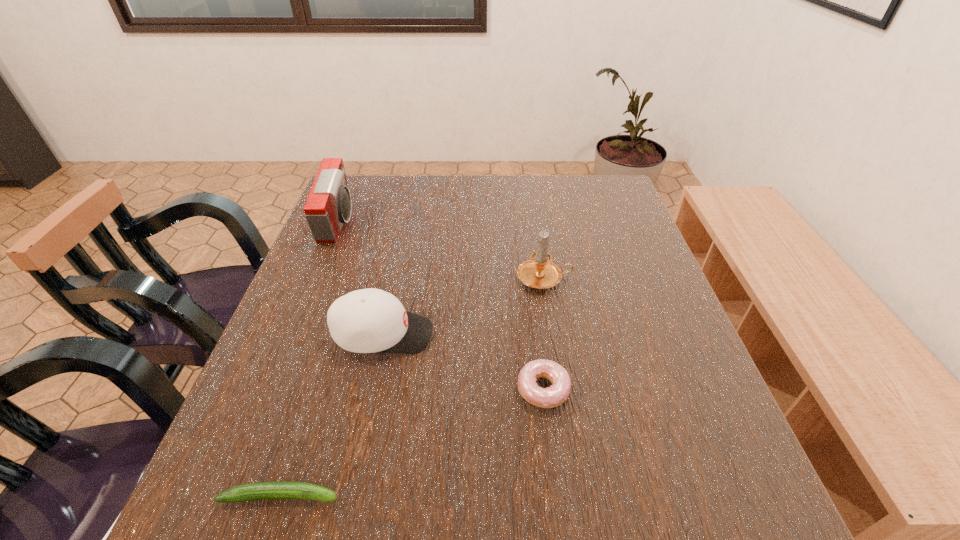
Identify the location of free space between the zucchini and the fourth nearest object. The image size is (960, 540). (413, 387).

Where is `free spot between the candle and the farthest object`? The image size is (960, 540). free spot between the candle and the farthest object is located at coordinates (442, 251).

Where is `unoccupied position between the camera and the fourth tallest object`? Image resolution: width=960 pixels, height=540 pixels. unoccupied position between the camera and the fourth tallest object is located at coordinates (441, 306).

You are a GUI agent. You are given a task and a screenshot of the screen. Output one action in this format:
    pyautogui.click(x=<x>, y=<y>)
    Task: Click on the free spot between the zucchini and the second shortest object
    
    Given the screenshot: What is the action you would take?
    pyautogui.click(x=412, y=443)

At what (x,y) coordinates should I click in order to perform the action: click on empty space between the second farthest object and the camera. Please return your answer as a coordinate pair (x, y). Image resolution: width=960 pixels, height=540 pixels. Looking at the image, I should click on (442, 251).

Find the location of `the second closest object relative to the zucchini`. the second closest object relative to the zucchini is located at coordinates (553, 396).

Select which object is the fourth closest to the third nearest object. Please provide its 2D coordinates. Your answer should be formatted as a tuple, i.e. [(x, y)], where the tuple contains the x and y coordinates of a point satisfying the conditions above.

[(262, 490)]

Locate an element on the screen. free location that satisfies the following two spatial constraints: 1. on the front-facing side of the third shortest object; 2. on the back side of the doughnut is located at coordinates (372, 389).

Find the location of a particular element. Image resolution: width=960 pixels, height=540 pixels. free space that satisfies the following two spatial constraints: 1. on the back side of the fourth tallest object; 2. on the front-facing side of the baseball cap is located at coordinates (537, 334).

Where is `free space in the image that satisfies the following two spatial constraints: 1. on the front side of the second farthest object; 2. on the front-facing side of the nearest object`? The height and width of the screenshot is (540, 960). free space in the image that satisfies the following two spatial constraints: 1. on the front side of the second farthest object; 2. on the front-facing side of the nearest object is located at coordinates (579, 496).